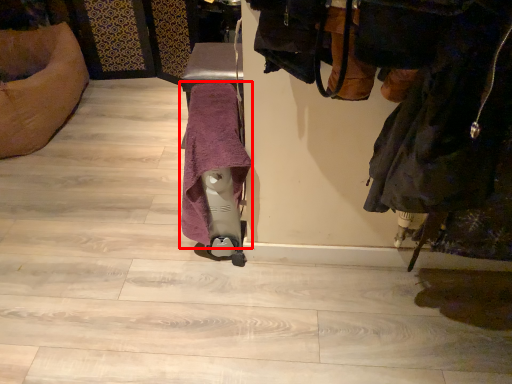
Question: Observing the image, what is the correct spatial positioning of bath towel (annotated by the red box) in reference to laundry?

Choices:
 (A) right
 (B) left

Answer: (B)